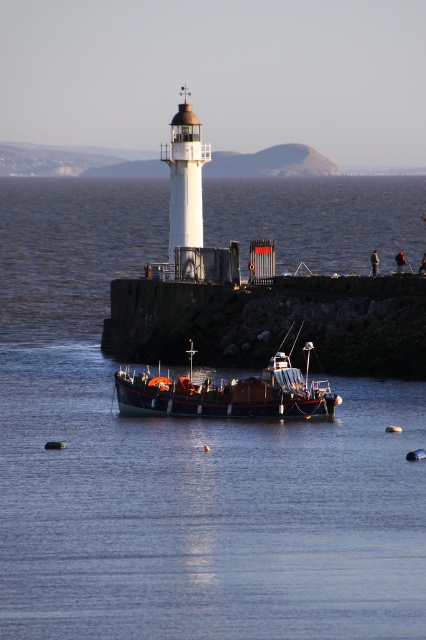
You are a drone operator trying to capture the lighthouse and the fishing boat in a single aerial shot. Given that the transparent water at center is located at coordinates point 0.728, 0.425, where should you position your drone to ensure both the lighthouse and the fishing boat are fully visible in the frame?

To capture both the lighthouse and the fishing boat in a single frame, position the drone above the transparent water at center, which is located at coordinates point (181,465). This central position will allow the drone to frame both the lighthouse on the jetty and the fishing boat nearby in the foreground.

You are a sailor trying to dock your wooden boat at center. The lighthouse is your reference point. According to the scene, where should you position your boat relative to the transparent water at center?

The transparent water at center is above the wooden boat at center, so you should position your boat below the transparent water at center to dock it properly.